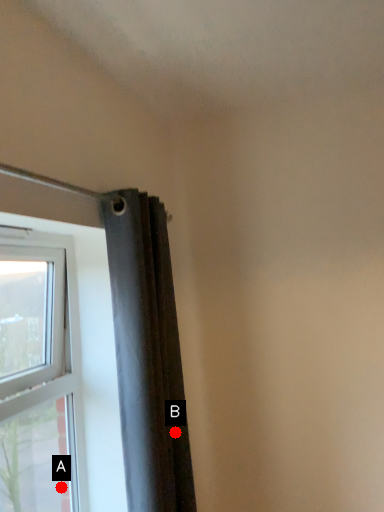
Question: Two points are circled on the image, labeled by A and B beside each circle. Which point appears closest to the camera in this image?

Choices:
 (A) A is closer
 (B) B is closer

Answer: (B)